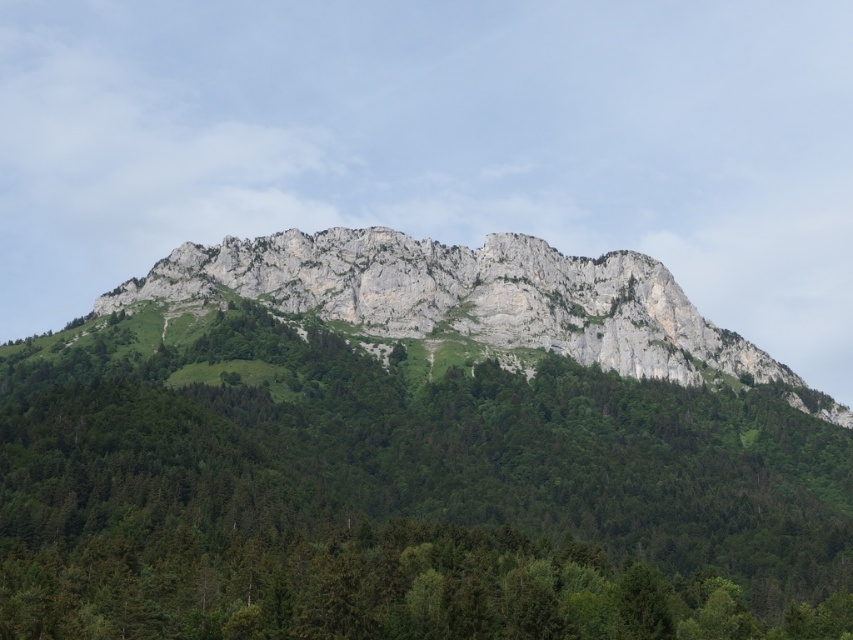
You are planning to plant a new tree in the forest area. The tree you want to plant grows to a maximum height of 30 meters. Considering the existing green leafy trees at center and the rugged stone mountain at center, will your new tree be able to grow to its full height without being blocked by the mountain?

The green leafy trees at center is not as tall as rugged stone mountain at center, so the new tree can grow to its full 30 meters height without being blocked by the mountain since the mountain is taller.

You are a hiker planning to cross the area between the green leafy trees at center and the rugged stone mountain at center. Which path would you choose if you want to take the narrower route?

The green leafy trees at center is thinner than the rugged stone mountain at center, so the narrower route would be through the green leafy trees at center.

You are a hiker standing at the base of the mountain. You see the green leafy trees at center and the rugged stone mountain at center. Which object is closer to you?

The green leafy trees at center are closer to you since they are positioned in front of the rugged stone mountain at center.